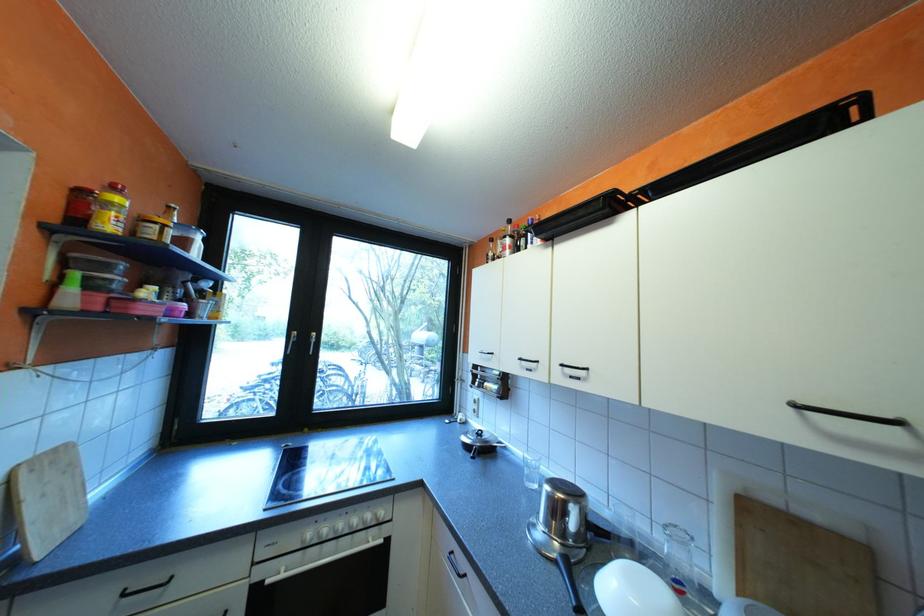
Where would you lift the clear drinking glass? Please return your answer as a coordinate pair (x, y).

(530, 469)